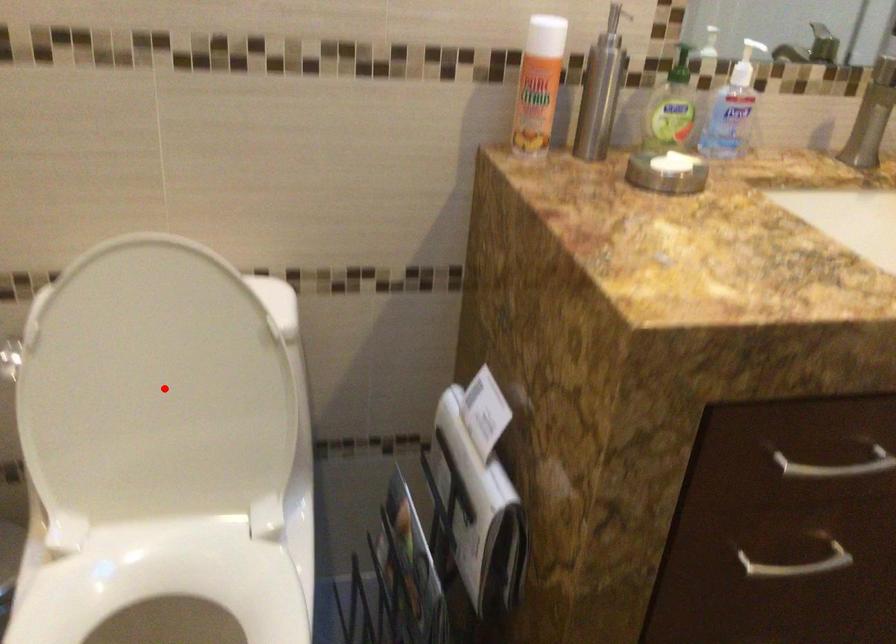
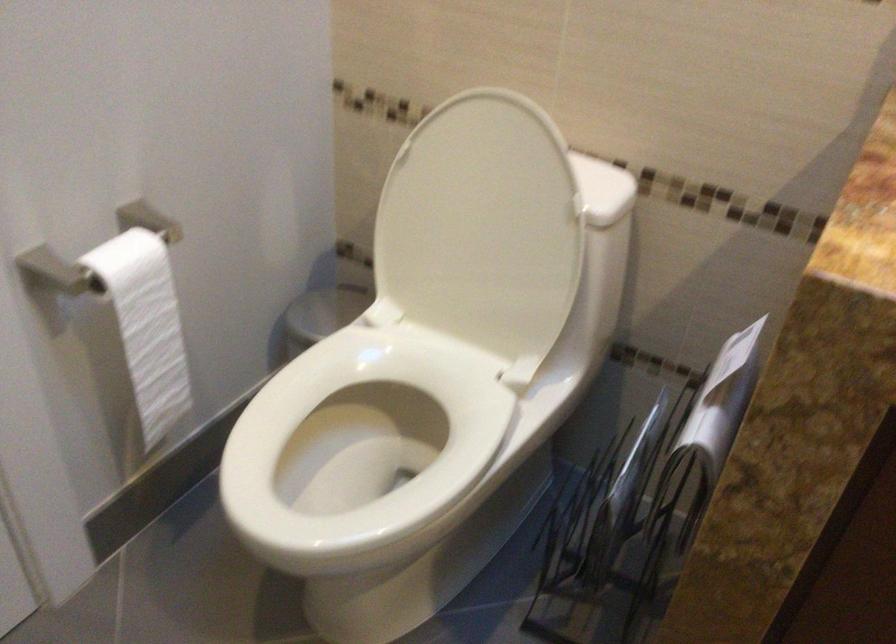
Where in the second image is the point corresponding to the highlighted location from the first image?

(483, 228)